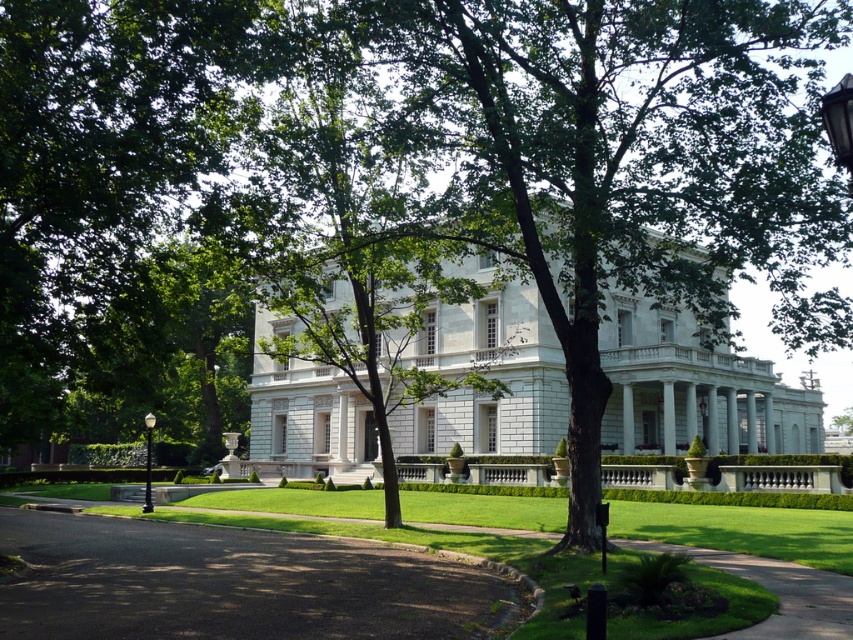
You are a gardener planning to plant a new row of flowers between the dark asphalt driveway at lower left and the black polished metal lamp post at left. Which object takes up more space in the scene?

The black polished metal lamp post at left occupies more space than the dark asphalt driveway at lower left.

You are a delivery person approaching the mansion and need to park your vehicle. The driveway and the lamp post are both visible from your current position. Which object is taller between the dark asphalt driveway at lower left and the black glass lamp post at upper right?

The dark asphalt driveway at lower left is taller than the black glass lamp post at upper right according to the description.

You are a visitor arriving at the mansion and need to park your car. The parking spot is located on the dark asphalt driveway at lower left. However, there is a black glass lamp post at upper right nearby. Considering their sizes, will the lamp post block your view when backing out of the parking spot?

The dark asphalt driveway at lower left is larger in size than the black glass lamp post at upper right. Since the driveway is bigger, there should be enough space around the lamp post to maneuver without obstruction, so the lamp post likely won